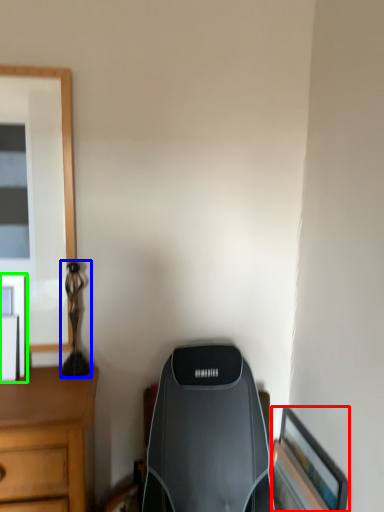
Question: Considering the real-world distances, which object is closest to picture frame (highlighted by a red box)? table lamp (highlighted by a blue box) or picture frame (highlighted by a green box).

Choices:
 (A) table lamp
 (B) picture frame

Answer: (A)